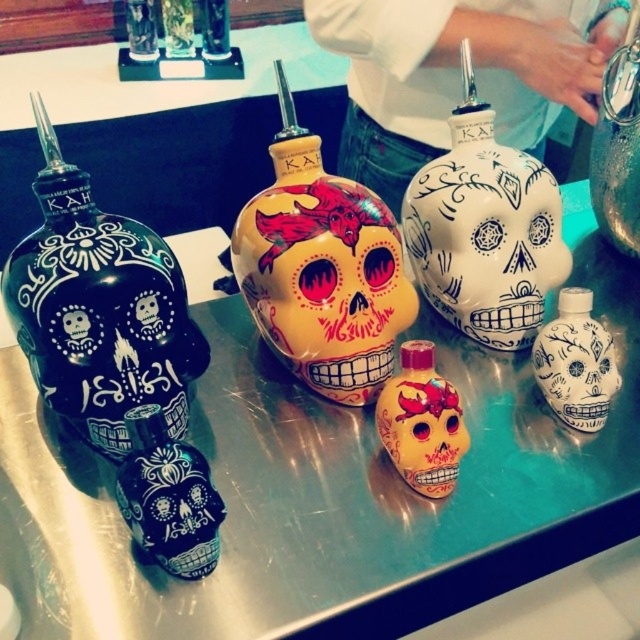
Who is shorter, white glossy skull at center or matte red skull at center?

With less height is matte red skull at center.

How far apart are white glossy skull at center and matte red skull at center?

The distance of white glossy skull at center from matte red skull at center is 9.43 inches.

At what (x,y) coordinates should I click in order to perform the action: click on white glossy skull at center. Please return your answer as a coordinate pair (x, y). This screenshot has width=640, height=640. Looking at the image, I should click on (484, 237).

Who is positioned more to the right, matte black skull at left or matte red skull at center?

From the viewer's perspective, matte red skull at center appears more on the right side.

Which is behind, point (92, 326) or point (419, 458)?

Point (419, 458)

I want to click on matte black skull at left, so click(x=99, y=308).

Locate an element on the screen. This screenshot has width=640, height=640. matte black skull at left is located at coordinates (99, 308).

Which is in front, point (392, 276) or point (579, 380)?

Positioned in front is point (579, 380).

Between yellow matte skull at center and white glossy skull at lower right, which one has more height?

yellow matte skull at center

The image size is (640, 640). Describe the element at coordinates (324, 282) in the screenshot. I see `yellow matte skull at center` at that location.

Where is `yellow matte skull at center`? The width and height of the screenshot is (640, 640). yellow matte skull at center is located at coordinates (324, 282).